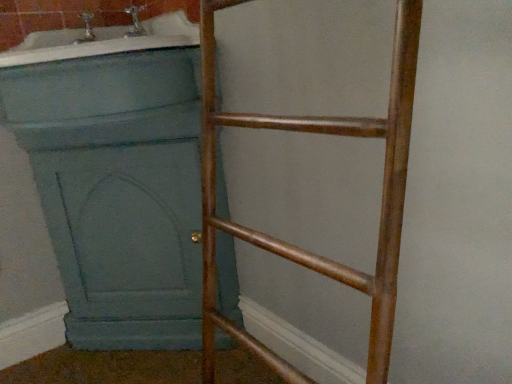
Question: From the image's perspective, would you say teal painted wood screen door at left is positioned over matte blue bathtub at upper left?

Choices:
 (A) no
 (B) yes

Answer: (A)

Question: Does teal painted wood screen door at left touch matte blue bathtub at upper left?

Choices:
 (A) yes
 (B) no

Answer: (B)

Question: Is teal painted wood screen door at left at the left side of matte blue bathtub at upper left?

Choices:
 (A) no
 (B) yes

Answer: (A)

Question: Is the depth of teal painted wood screen door at left greater than that of matte blue bathtub at upper left?

Choices:
 (A) no
 (B) yes

Answer: (B)

Question: From a real-world perspective, is teal painted wood screen door at left located higher than matte blue bathtub at upper left?

Choices:
 (A) yes
 (B) no

Answer: (B)

Question: Is point pyautogui.click(x=123, y=46) positioned closer to the camera than point pyautogui.click(x=198, y=158)?

Choices:
 (A) closer
 (B) farther

Answer: (A)

Question: Is matte blue bathtub at upper left taller or shorter than teal painted wood screen door at left?

Choices:
 (A) short
 (B) tall

Answer: (A)

Question: From the image's perspective, is matte blue bathtub at upper left positioned above or below teal painted wood screen door at left?

Choices:
 (A) above
 (B) below

Answer: (A)

Question: Visually, is matte blue bathtub at upper left positioned to the left or to the right of teal painted wood screen door at left?

Choices:
 (A) left
 (B) right

Answer: (A)

Question: Considering their positions, is bronze metallic ladder at right located in front of or behind matte blue bathtub at upper left?

Choices:
 (A) behind
 (B) front

Answer: (B)

Question: Visually, is bronze metallic ladder at right positioned to the left or to the right of matte blue bathtub at upper left?

Choices:
 (A) left
 (B) right

Answer: (B)

Question: From a real-world perspective, is bronze metallic ladder at right above or below matte blue bathtub at upper left?

Choices:
 (A) above
 (B) below

Answer: (B)

Question: Looking at the image, does bronze metallic ladder at right seem bigger or smaller compared to matte blue bathtub at upper left?

Choices:
 (A) small
 (B) big

Answer: (B)

Question: In the image, is bronze metallic ladder at right positioned in front of or behind teal painted wood screen door at left?

Choices:
 (A) behind
 (B) front

Answer: (B)

Question: Looking at their shapes, would you say bronze metallic ladder at right is wider or thinner than teal painted wood screen door at left?

Choices:
 (A) thin
 (B) wide

Answer: (A)